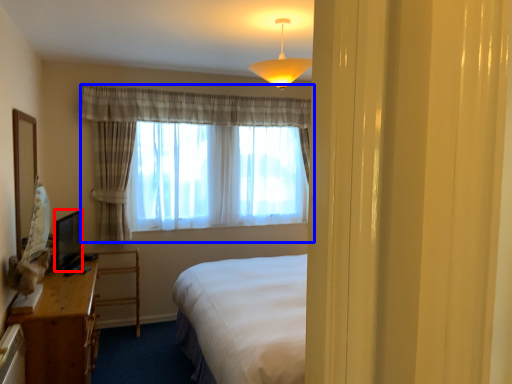
Question: Which object is closer to the camera taking this photo, television (highlighted by a red box) or curtain (highlighted by a blue box)?

Choices:
 (A) television
 (B) curtain

Answer: (A)